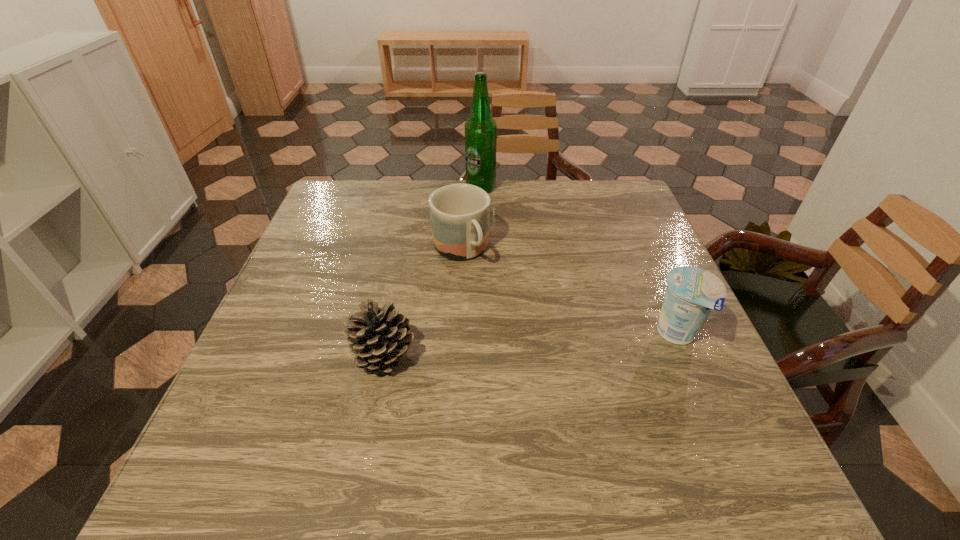
The width and height of the screenshot is (960, 540). What are the coordinates of `the leftmost object` in the screenshot? It's located at (379, 338).

Locate an element on the screen. yogurt is located at coordinates (692, 293).

What are the coordinates of `the second farthest object` in the screenshot? It's located at (460, 213).

In order to click on the tallest object in this screenshot , I will do `click(480, 128)`.

You are a GUI agent. You are given a task and a screenshot of the screen. Output one action in this format:
    pyautogui.click(x=<x>, y=<y>)
    Task: Click on the farthest object
    The width and height of the screenshot is (960, 540).
    Given the screenshot: What is the action you would take?
    pyautogui.click(x=480, y=128)

Find the location of a particular element. The image size is (960, 540). vacant space located 0.050m on the right of the leftmost object is located at coordinates (442, 355).

In order to click on vacant region located 0.370m on the left of the yogurt in this screenshot , I will do `click(477, 334)`.

Where is `vacant space positioned 0.140m on the side with the handle of the mug`? This screenshot has height=540, width=960. vacant space positioned 0.140m on the side with the handle of the mug is located at coordinates (497, 310).

The image size is (960, 540). In order to click on vacant space located 0.110m on the side with the handle of the mug in this screenshot , I will do `click(492, 302)`.

Image resolution: width=960 pixels, height=540 pixels. What are the coordinates of `free space located 0.320m on the side with the handle of the mug` in the screenshot? It's located at (537, 370).